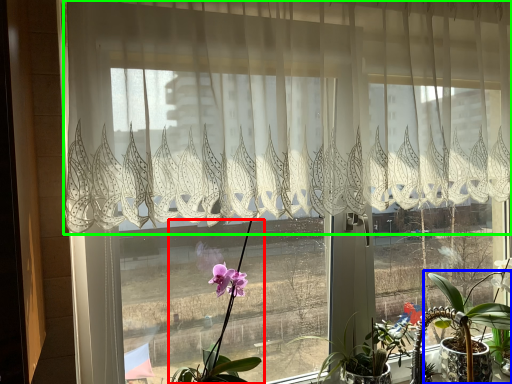
Question: Estimate the real-world distances between objects in this image. Which object is farther from houseplant (highlighted by a red box), houseplant (highlighted by a blue box) or curtain (highlighted by a green box)?

Choices:
 (A) houseplant
 (B) curtain

Answer: (A)